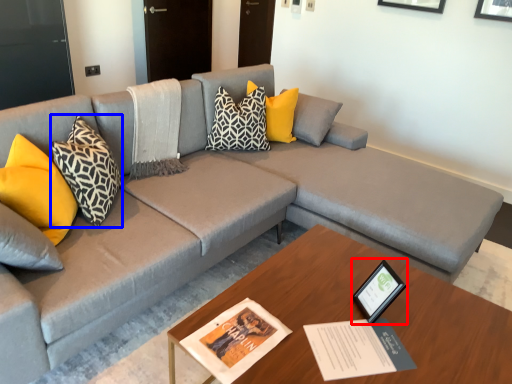
Question: Which object appears closest to the camera in this image, picture frame (highlighted by a red box) or pillow (highlighted by a blue box)?

Choices:
 (A) picture frame
 (B) pillow

Answer: (A)